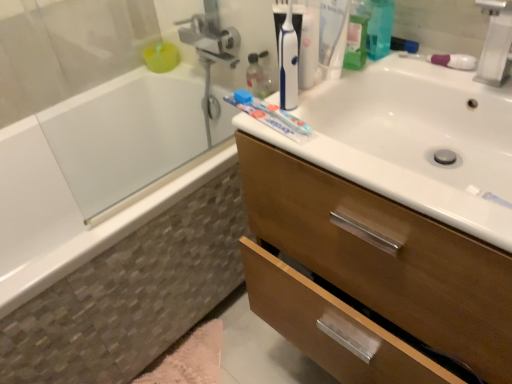
Question: Is white frosted glass bathtub at left, positioned as the 1th bath in top-to-bottom order, smaller than white plastic faucet at upper right?

Choices:
 (A) yes
 (B) no

Answer: (B)

Question: Is white frosted glass bathtub at left, which is the 2th bath in bottom-to-top order, thinner than white plastic faucet at upper right?

Choices:
 (A) yes
 (B) no

Answer: (B)

Question: Does white frosted glass bathtub at left, positioned as the 1th bath in top-to-bottom order, have a greater height compared to white plastic faucet at upper right?

Choices:
 (A) no
 (B) yes

Answer: (B)

Question: Is white frosted glass bathtub at left, which is the 2th bath in bottom-to-top order, looking in the opposite direction of white plastic faucet at upper right?

Choices:
 (A) no
 (B) yes

Answer: (A)

Question: Is white frosted glass bathtub at left, which is the 2th bath in bottom-to-top order, positioned behind white plastic faucet at upper right?

Choices:
 (A) yes
 (B) no

Answer: (A)

Question: In terms of height, does white plastic faucet at upper right look taller or shorter compared to white glossy sink at upper right?

Choices:
 (A) tall
 (B) short

Answer: (A)

Question: Is white plastic faucet at upper right wider or thinner than white glossy sink at upper right?

Choices:
 (A) thin
 (B) wide

Answer: (A)

Question: From the image's perspective, is white plastic faucet at upper right above or below white glossy sink at upper right?

Choices:
 (A) above
 (B) below

Answer: (A)

Question: Relative to white glossy sink at upper right, is white plastic faucet at upper right in front or behind?

Choices:
 (A) front
 (B) behind

Answer: (B)

Question: Based on their positions, is white glossy bathtub at left, which ranks as the 1th bath in bottom-to-top order, located to the left or right of white plastic faucet at upper right?

Choices:
 (A) left
 (B) right

Answer: (A)

Question: Based on their sizes in the image, would you say white glossy bathtub at left, which ranks as the 1th bath in bottom-to-top order, is bigger or smaller than white plastic faucet at upper right?

Choices:
 (A) big
 (B) small

Answer: (A)

Question: Looking at their shapes, would you say white glossy bathtub at left, which ranks as the 1th bath in bottom-to-top order, is wider or thinner than white plastic faucet at upper right?

Choices:
 (A) thin
 (B) wide

Answer: (B)

Question: From a real-world perspective, relative to white plastic faucet at upper right, is white glossy bathtub at left, which ranks as the 1th bath in bottom-to-top order, vertically above or below?

Choices:
 (A) below
 (B) above

Answer: (A)

Question: Do you think white frosted glass bathtub at left, which is the 2th bath in bottom-to-top order, is within pink fluffy bath mat at lower left, or outside of it?

Choices:
 (A) outside
 (B) inside

Answer: (A)

Question: Does point (193, 109) appear closer or farther from the camera than point (199, 379)?

Choices:
 (A) closer
 (B) farther

Answer: (B)